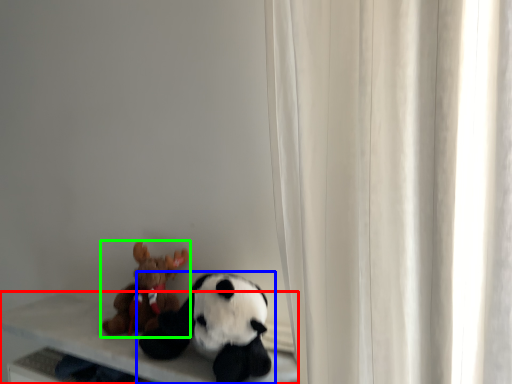
Question: Estimate the real-world distances between objects in this image. Which object is farther from table (highlighted by a red box), toy (highlighted by a blue box) or toy (highlighted by a green box)?

Choices:
 (A) toy
 (B) toy

Answer: (A)